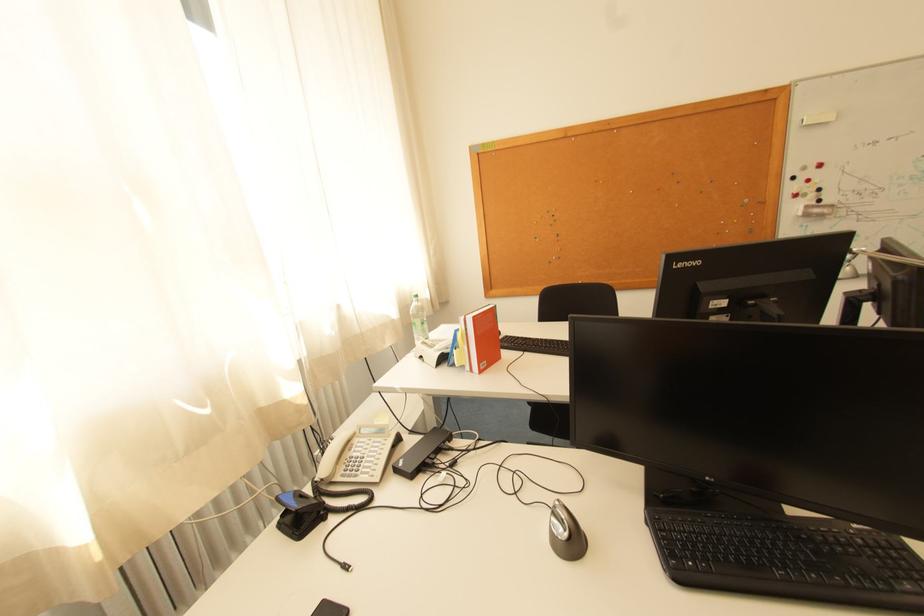
Which object does [819,118] point to?

It corresponds to the whiteboard eraser in the image.